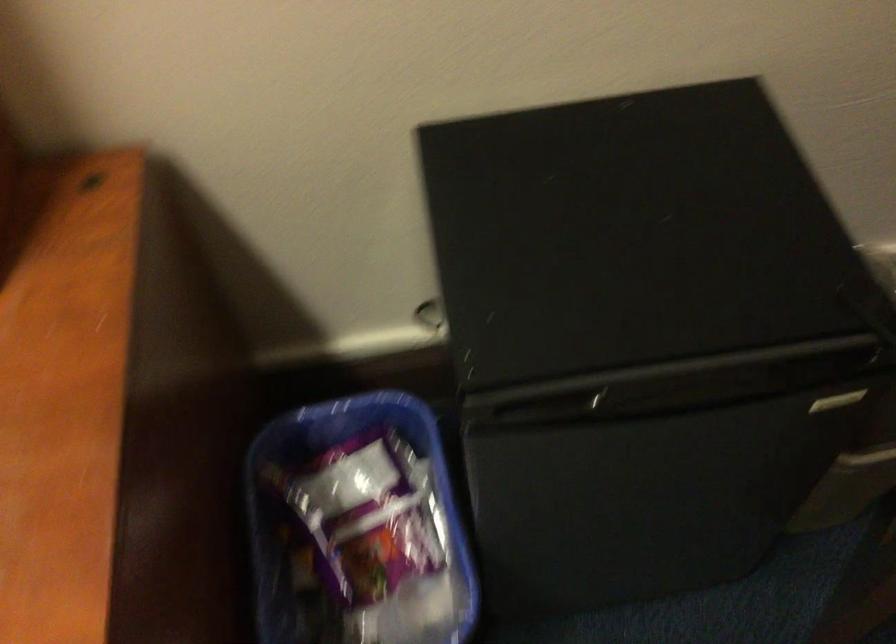
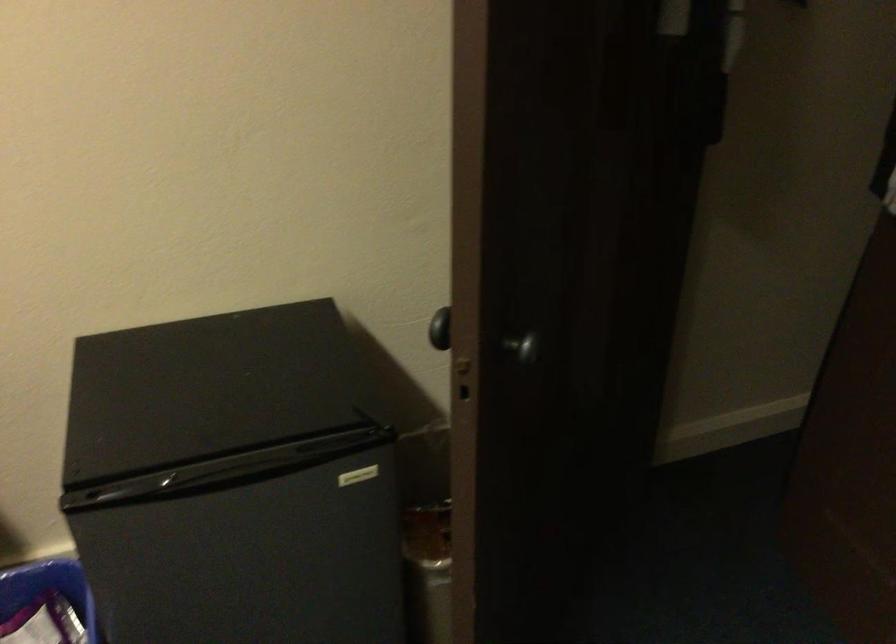
Question: How did the camera likely rotate?

Choices:
 (A) Left
 (B) Right
 (C) Up
 (D) Down

Answer: (C)